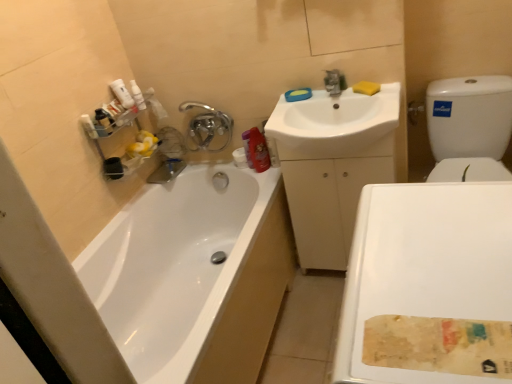
Question: In the image, is white glossy toilet at right positioned in front of or behind silver metallic faucet at upper center?

Choices:
 (A) behind
 (B) front

Answer: (B)

Question: From their relative heights in the image, would you say white glossy toilet at right is taller or shorter than silver metallic faucet at upper center?

Choices:
 (A) tall
 (B) short

Answer: (A)

Question: Which object is positioned closest to the white matte bottles at upper left, positioned as the second cleaning product in bottom-to-top order?

Choices:
 (A) matte plastic mouthwash at upper left
 (B) white glossy toilet at right
 (C) matte red bottle at upper right, the first cleaning product in the bottom-to-top sequence
 (D) yellow sponge at upper center
 (E) white glossy sink at upper center

Answer: (A)

Question: Which object is positioned farthest from the white glossy sink at upper center?

Choices:
 (A) white matte bottles at upper left, positioned as the second cleaning product in bottom-to-top order
 (B) white glossy bathtub at left
 (C) yellow sponge at upper center
 (D) matte red bottle at upper right, the first cleaning product in the bottom-to-top sequence
 (E) matte plastic mouthwash at upper left

Answer: (E)